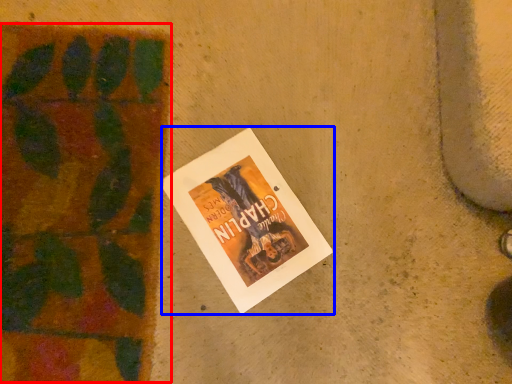
Question: Which of the following is the farthest to the observer, plant (highlighted by a red box) or book (highlighted by a blue box)?

Choices:
 (A) plant
 (B) book

Answer: (B)